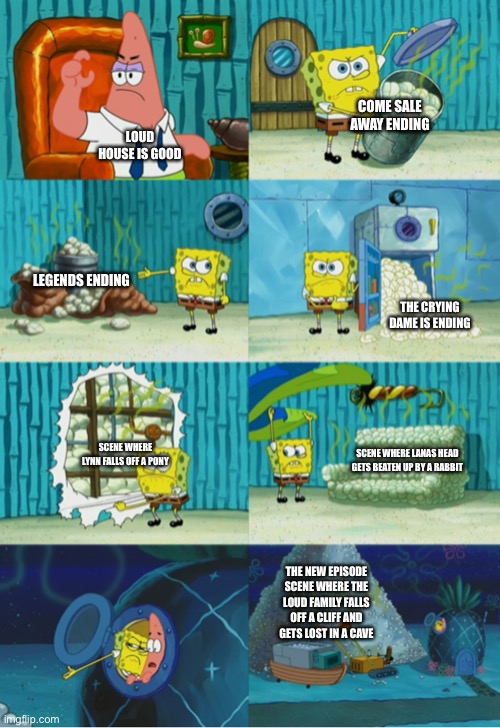
Where is `red chair`? The height and width of the screenshot is (728, 500). red chair is located at coordinates (29, 116).